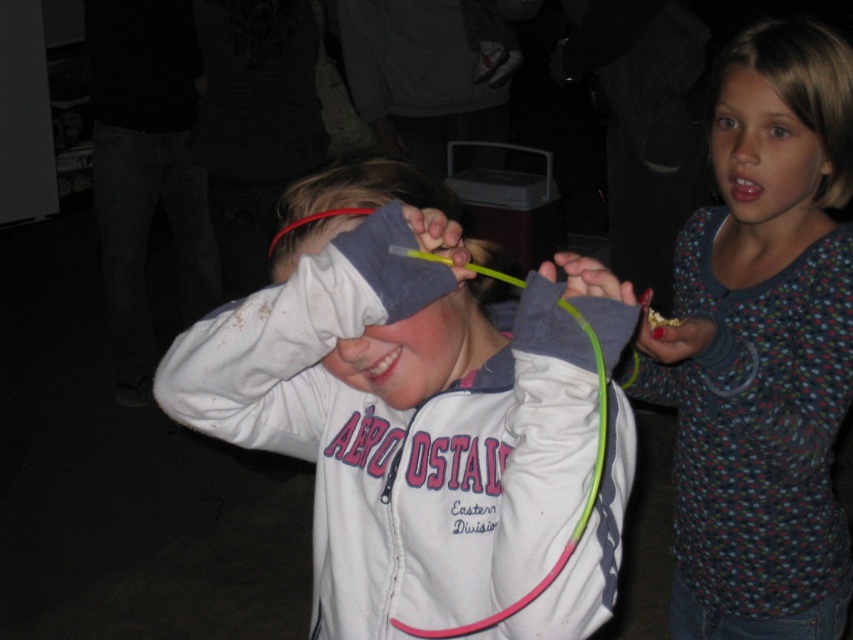
Question: Considering the real-world distances, which object is closest to the smooth skin nose at upper right?

Choices:
 (A) smooth gray cloth at center
 (B) white glossy teeth at center

Answer: (A)

Question: Which point is closer to the camera?

Choices:
 (A) smooth skin nose at upper right
 (B) smooth skin face at upper right
 (C) white glossy teeth at center
 (D) smooth glossy teeth at upper right

Answer: (C)

Question: Which point appears farthest from the camera in this image?

Choices:
 (A) (431, 323)
 (B) (798, 54)

Answer: (B)

Question: Is polka dot sweater at right to the right of smooth gray cloth at center from the viewer's perspective?

Choices:
 (A) no
 (B) yes

Answer: (B)

Question: Does white glossy teeth at center have a larger size compared to brown shiny eye at upper right?

Choices:
 (A) yes
 (B) no

Answer: (A)

Question: Is smooth skin at upper right below blue eye at upper center?

Choices:
 (A) yes
 (B) no

Answer: (B)